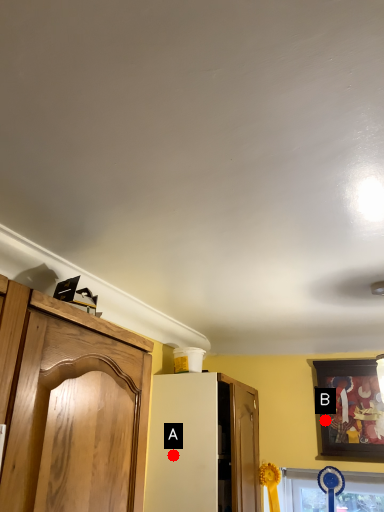
Question: Two points are circled on the image, labeled by A and B beside each circle. Which of the following is the farthest from the observer?

Choices:
 (A) A is further
 (B) B is further

Answer: (B)